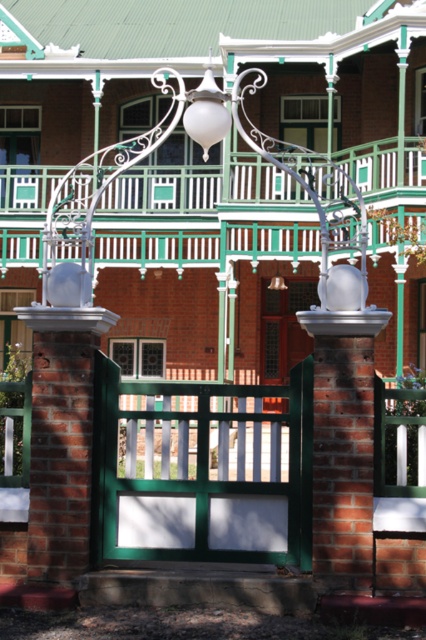
Who is more forward, (x=270, y=483) or (x=270, y=314)?

Point (x=270, y=483) is in front.

Consider the image. Is green painted wood gate at center shorter than matte glass door at center?

Yes.

Is point (129, 477) more distant than point (310, 352)?

That is False.

Find the location of `green painted wood gate at center`. green painted wood gate at center is located at coordinates (203, 468).

Is matte glass door at center above white matte lamp at upper center?

Actually, matte glass door at center is below white matte lamp at upper center.

Which is below, matte glass door at center or white matte lamp at upper center?

Positioned lower is matte glass door at center.

Find the location of a particular element. This screenshot has width=426, height=640. matte glass door at center is located at coordinates tap(284, 328).

Does point (230, 388) come closer to viewer compared to point (193, 104)?

Yes, point (230, 388) is closer to viewer.

Does green painted wood gate at center come behind white matte lamp at upper center?

No, it is not.

Who is more distant from viewer, (238, 477) or (204, 83)?

The point (204, 83) is behind.

Image resolution: width=426 pixels, height=640 pixels. I want to click on green painted wood gate at center, so click(x=203, y=468).